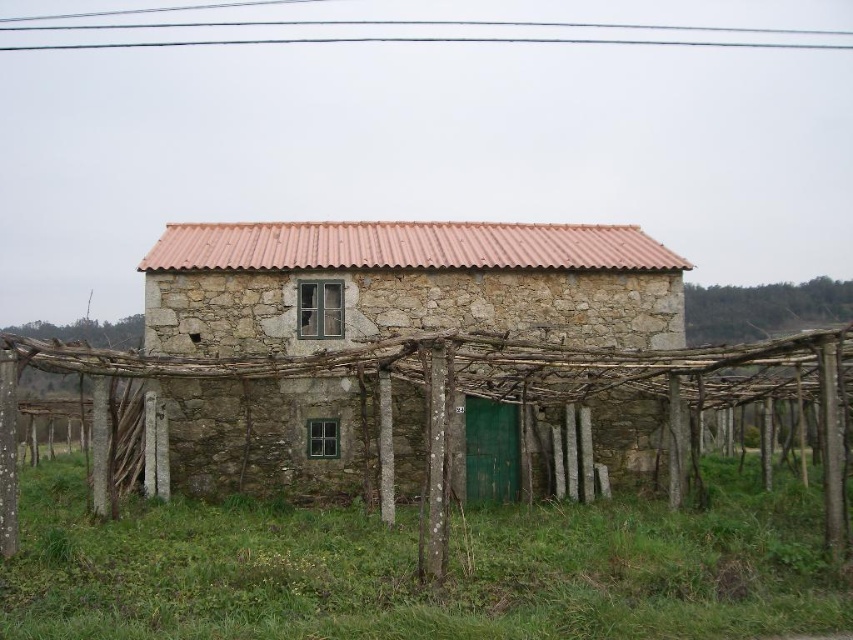
You are standing at the origin point of the coordinate system. Where is the rustic stone barn at center located?

The rustic stone barn at center is located at point (405, 285).

Consider the image. You are a painter who needs to paint both the rustic stone barn at center and the brown wooden trellis at center. You have a ladder that is 1.5 meters long. Can you safely reach both structures from the ground without moving the ladder?

The rustic stone barn at center is 1.72 meters from the brown wooden trellis at center. Since the ladder is only 1.5 meters long, it cannot reach both structures as the distance between them exceeds the ladder length.

You are standing in front of the rustic stone barn at center. If you want to take a photo that captures the entire structure without any cropping, what is the minimum distance you should maintain from the barn?

The rustic stone barn at center is 41.67 feet from camera. To capture the entire structure without cropping, you should maintain at least 41.67 feet distance from the barn.